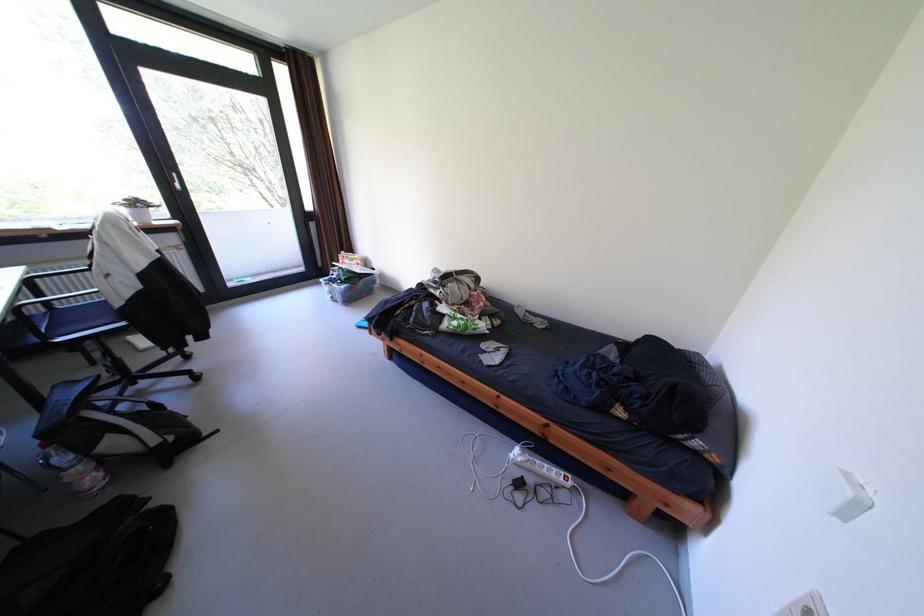
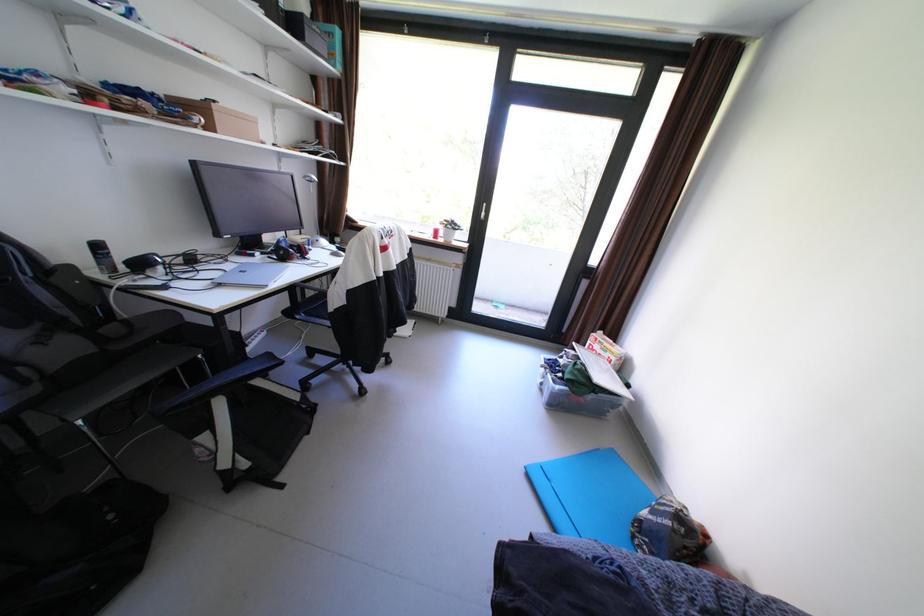
Locate, in the second image, the point that corresponds to the point at 68,339 in the first image.

(309, 317)